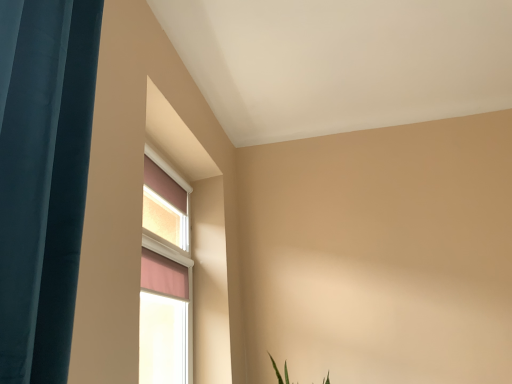
The height and width of the screenshot is (384, 512). In order to click on teal fabric curtain at left in this screenshot , I will do pos(42,178).

The image size is (512, 384). Describe the element at coordinates (42, 178) in the screenshot. I see `teal fabric curtain at left` at that location.

In order to face teal fabric curtain at left, should I rotate leftwards or rightwards?

Rotate your view left by about 27.568°.

Measure the distance between point (64, 373) and camera.

Point (64, 373) is 32.05 inches from camera.

What is the approximate height of teal fabric curtain at left?

teal fabric curtain at left is 3.56 feet in height.

What do you see at coordinates (165, 277) in the screenshot? The width and height of the screenshot is (512, 384). I see `pink fabric window at upper left` at bounding box center [165, 277].

Identify the location of pink fabric window at upper left. This screenshot has width=512, height=384. tap(165, 277).

The height and width of the screenshot is (384, 512). Identify the location of teal fabric curtain at left. (42, 178).

Is teal fabric curtain at left at the left side of pink fabric window at upper left?

Yes.

Which object is more forward, teal fabric curtain at left or pink fabric window at upper left?

teal fabric curtain at left.

Is point (47, 322) closer to camera compared to point (187, 184)?

Yes, point (47, 322) is in front of point (187, 184).

From the image's perspective, is teal fabric curtain at left located above or below pink fabric window at upper left?

Clearly, from the image's perspective, teal fabric curtain at left is above pink fabric window at upper left.

From a real-world perspective, is teal fabric curtain at left positioned under pink fabric window at upper left based on gravity?

No, from a real-world perspective, teal fabric curtain at left is not beneath pink fabric window at upper left.

Considering the relative sizes of teal fabric curtain at left and pink fabric window at upper left in the image provided, is teal fabric curtain at left thinner than pink fabric window at upper left?

No.

Is teal fabric curtain at left shorter than pink fabric window at upper left?

Correct, teal fabric curtain at left is not as tall as pink fabric window at upper left.

Looking at the image, does teal fabric curtain at left seem bigger or smaller compared to pink fabric window at upper left?

teal fabric curtain at left is bigger than pink fabric window at upper left.

In the scene shown: Is teal fabric curtain at left situated inside pink fabric window at upper left or outside?

teal fabric curtain at left exists outside the volume of pink fabric window at upper left.

In the scene shown: Is teal fabric curtain at left placed right next to pink fabric window at upper left?

No, teal fabric curtain at left is not next to pink fabric window at upper left.

Is teal fabric curtain at left facing towards pink fabric window at upper left?

No, teal fabric curtain at left is not oriented towards pink fabric window at upper left.

Can you tell me how much teal fabric curtain at left and pink fabric window at upper left differ in facing direction?

0.91 degrees.

This screenshot has height=384, width=512. In order to click on window to the right of teal fabric curtain at left in this screenshot , I will do `click(165, 277)`.

Is pink fabric window at upper left to the left of teal fabric curtain at left from the viewer's perspective?

Incorrect, pink fabric window at upper left is not on the left side of teal fabric curtain at left.

Which object is closer to the camera, pink fabric window at upper left or teal fabric curtain at left?

teal fabric curtain at left is more forward.

Which is less distant, (146, 233) or (1, 283)?

The point (1, 283) is closer.

From the image's perspective, does pink fabric window at upper left appear lower than teal fabric curtain at left?

Indeed, from the image's perspective, pink fabric window at upper left is shown beneath teal fabric curtain at left.

From a real-world perspective, is pink fabric window at upper left over teal fabric curtain at left?

No, from a real-world perspective, pink fabric window at upper left is not above teal fabric curtain at left.

Looking at their sizes, would you say pink fabric window at upper left is wider or thinner than teal fabric curtain at left?

Clearly, pink fabric window at upper left has less width compared to teal fabric curtain at left.

Who is taller, pink fabric window at upper left or teal fabric curtain at left?

Standing taller between the two is pink fabric window at upper left.

Which of these two, pink fabric window at upper left or teal fabric curtain at left, is bigger?

Bigger between the two is teal fabric curtain at left.

Is pink fabric window at upper left outside of teal fabric curtain at left?

Yes.

Is pink fabric window at upper left beside teal fabric curtain at left?

pink fabric window at upper left is not next to teal fabric curtain at left, and they're not touching.

Is pink fabric window at upper left oriented towards teal fabric curtain at left?

No, pink fabric window at upper left is not oriented towards teal fabric curtain at left.

Can you tell me how much pink fabric window at upper left and teal fabric curtain at left differ in facing direction?

They differ by 0.91 degrees in their facing directions.

Measure the distance from pink fabric window at upper left to teal fabric curtain at left.

pink fabric window at upper left is 4.64 feet away from teal fabric curtain at left.

Locate an element on the screen. curtain on the left of pink fabric window at upper left is located at coordinates (42, 178).

Locate an element on the screen. curtain above the pink fabric window at upper left (from a real-world perspective) is located at coordinates pyautogui.click(x=42, y=178).

Locate an element on the screen. Image resolution: width=512 pixels, height=384 pixels. window that is behind the teal fabric curtain at left is located at coordinates (165, 277).